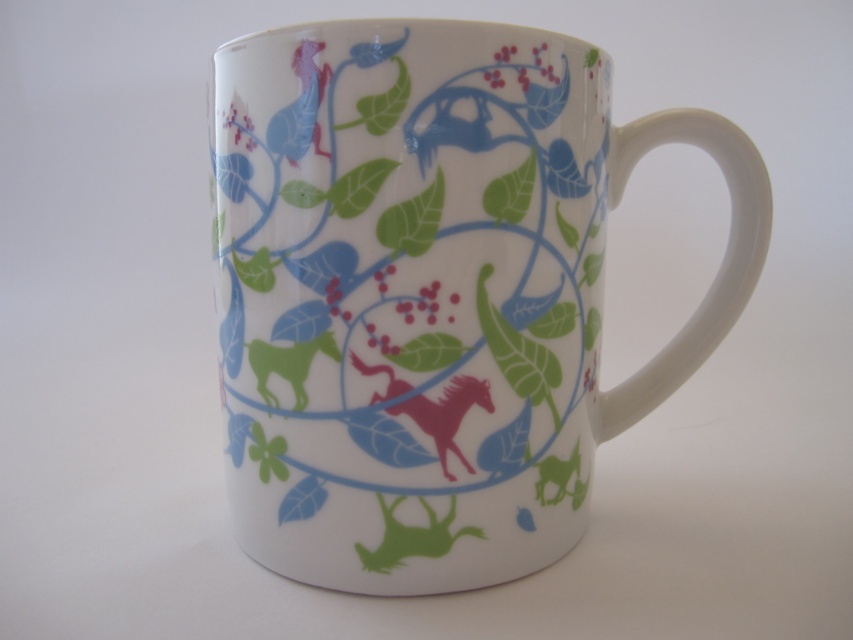
You are holding the ceramic mug and looking at its design. There are two points marked on the mug at coordinates point (456, 51) and point (399, 403). From your perspective, which point is closer to you?

Point (456, 51) is in front of point (399, 403), so it is closer to you.

You are an artist standing at the origin point of the coordinate system. You want to paint the porcelain mug at center. What are the coordinates where you should aim your brush?

The porcelain mug at center is located at coordinates point [433,292], so you should aim your brush at point [433,292].

You have a small shelf that can only accommodate items up to 10 centimeters in width. You want to place both the porcelain mug at center and the pink glossy horse at center on the shelf. Can both items fit side by side?

The porcelain mug at center is wider than the pink glossy horse at center. Since the shelf can only hold items up to 10 centimeters, we need to know the exact widths. However, since the mug is larger, if the mug alone exceeds 10 cm, both won